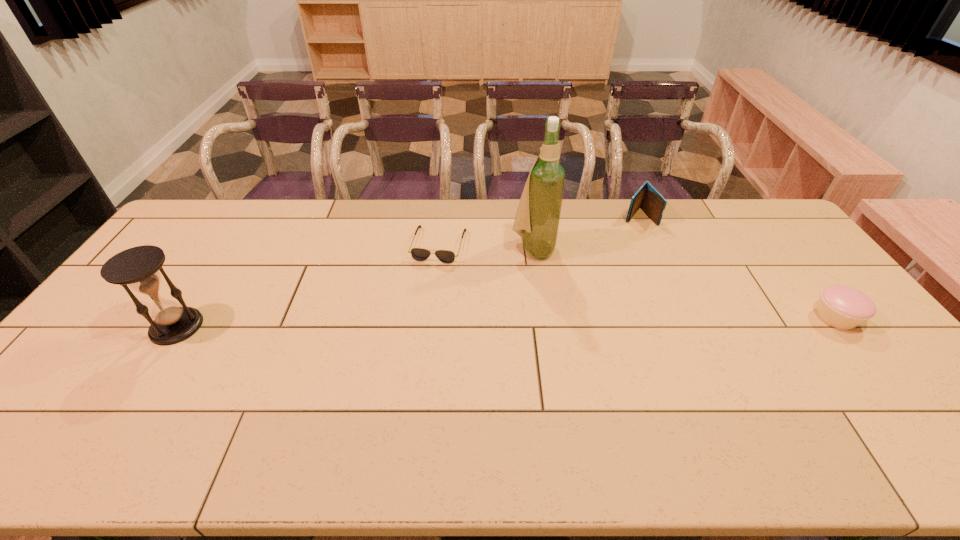
You are a GUI agent. You are given a task and a screenshot of the screen. Output one action in this format:
    pyautogui.click(x=<x>, y=<y>)
    Task: Click on the vacant space on the desktop that is between the leftmost object and the rightmost object and is positioned on the front-facing side of the wine bottle
    
    Given the screenshot: What is the action you would take?
    pyautogui.click(x=605, y=321)

The image size is (960, 540). In order to click on free spot on the desktop that is between the leftmost object and the cupcake and is positioned on the exterior surface of the farthest object in this screenshot , I will do `click(550, 321)`.

Identify the location of vacant space on the desktop that is between the second tallest object and the fourth tallest object and is positioned on the front-facing side of the sunglasses. (415, 323).